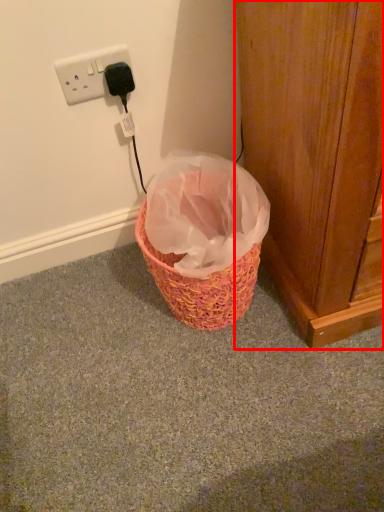
Question: Where is door (annotated by the red box) located in relation to power plugs and sockets in the image?

Choices:
 (A) right
 (B) left

Answer: (A)